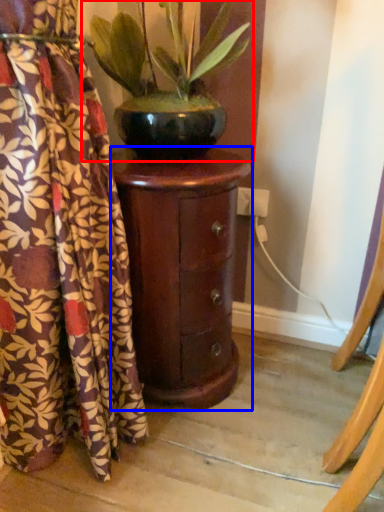
Question: Which object appears closest to the camera in this image, houseplant (highlighted by a red box) or furniture (highlighted by a blue box)?

Choices:
 (A) houseplant
 (B) furniture

Answer: (A)